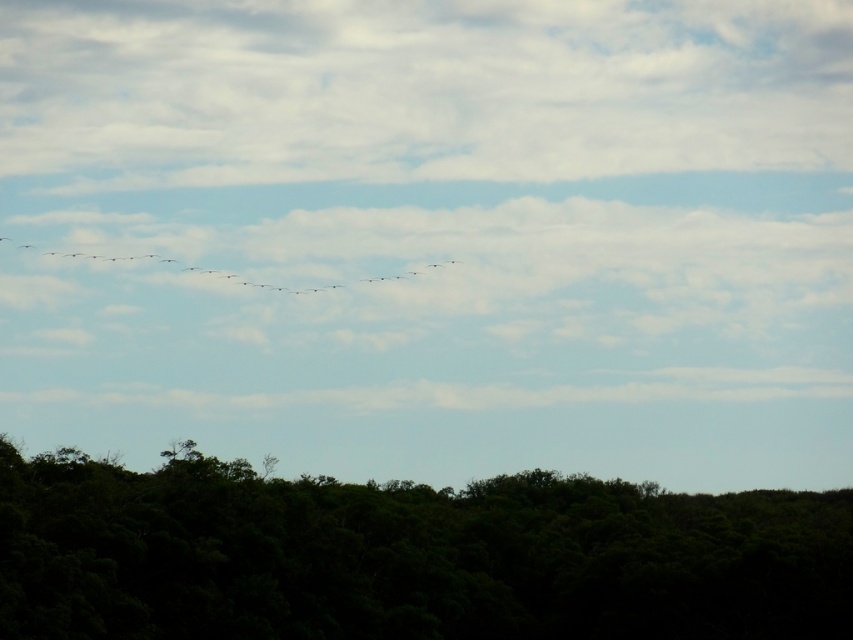
Question: Is green leafy trees at lower center positioned behind gray matte birds at center?

Choices:
 (A) yes
 (B) no

Answer: (B)

Question: From the image, what is the correct spatial relationship of gray matte birds at center in relation to silhouette feathered bird at left?

Choices:
 (A) right
 (B) left

Answer: (A)

Question: Among these objects, which one is nearest to the camera?

Choices:
 (A) silhouette feathered bird at left
 (B) gray matte birds at center
 (C) green leafy trees at lower center

Answer: (C)

Question: Which object is positioned farthest from the gray matte birds at center?

Choices:
 (A) green leafy trees at lower center
 (B) silhouette feathered bird at left

Answer: (A)

Question: Which of the following is the closest to the observer?

Choices:
 (A) (425, 262)
 (B) (732, 577)

Answer: (B)

Question: Is green leafy trees at lower center to the left of silhouette feathered bird at left from the viewer's perspective?

Choices:
 (A) no
 (B) yes

Answer: (A)